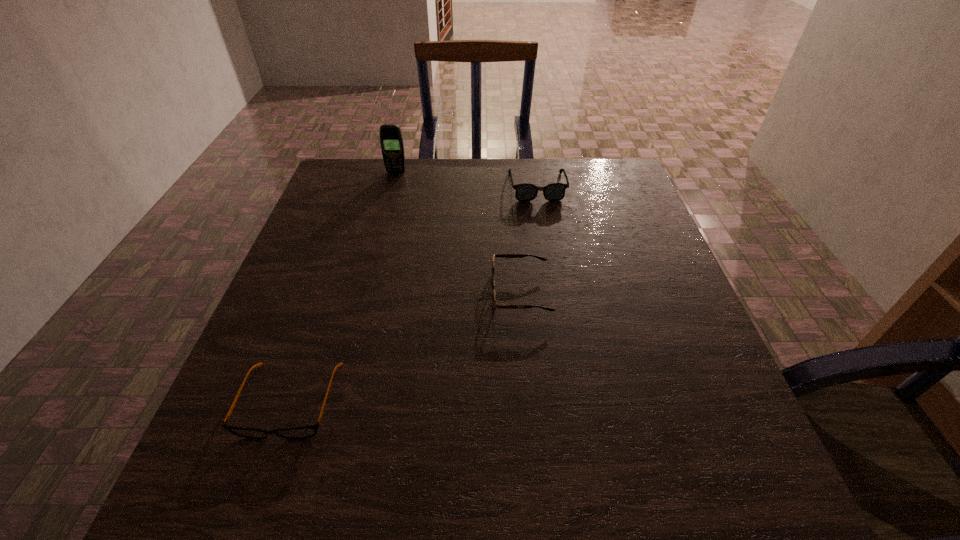
What are the coordinates of `blank space at the far left corner of the desktop` in the screenshot? It's located at (372, 193).

In the image, there is a desktop. Identify the location of vacant space at the near left corner. (248, 465).

What are the coordinates of `vacant area between the tallest object and the second nearest spectacles` in the screenshot? It's located at (458, 233).

This screenshot has height=540, width=960. I want to click on blank region between the cellular telephone and the farthest spectacles, so click(467, 180).

Find the location of a particular element. free space that is in between the second nearest object and the farthest spectacles is located at coordinates (529, 240).

Where is `free space between the cellular telephone and the second nearest spectacles`? free space between the cellular telephone and the second nearest spectacles is located at coordinates (458, 233).

The height and width of the screenshot is (540, 960). In order to click on vacant space in between the farthest spectacles and the tallest object in this screenshot , I will do `click(467, 180)`.

Locate an element on the screen. The width and height of the screenshot is (960, 540). unoccupied area between the farthest spectacles and the third farthest object is located at coordinates (x=529, y=240).

What are the coordinates of `vacant space that's between the farthest spectacles and the nearest spectacles` in the screenshot? It's located at (414, 294).

Where is `vacant space in between the nearest object and the second nearest object`? The image size is (960, 540). vacant space in between the nearest object and the second nearest object is located at coordinates (405, 347).